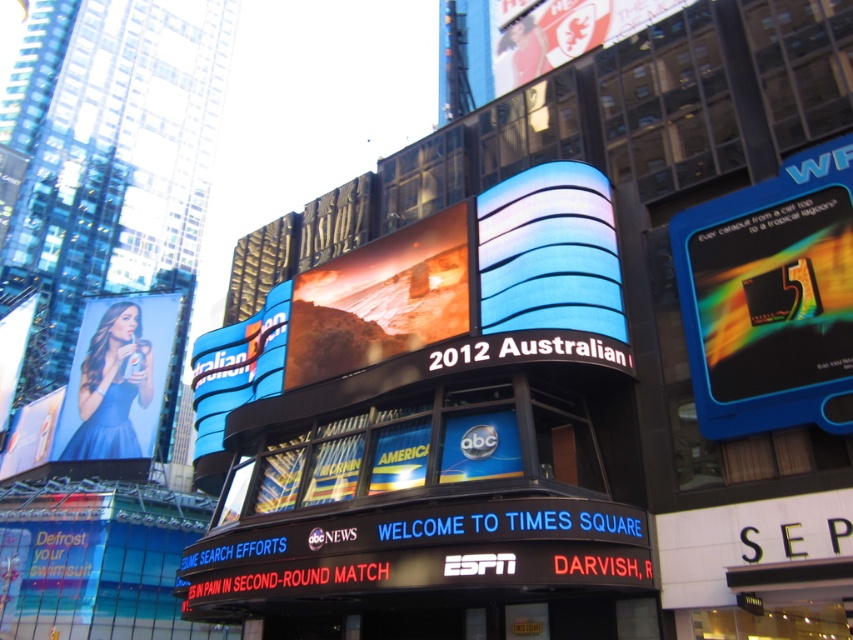
Does metallic silver lion at upper center have a smaller size compared to matte plastic billboard at upper left?

Yes.

Is metallic silver lion at upper center bigger than matte plastic billboard at upper left?

No.

Who is more forward, (621,6) or (0,432)?

Point (621,6) is in front.

This screenshot has height=640, width=853. Find the location of `metallic silver lion at upper center`. metallic silver lion at upper center is located at coordinates (563, 32).

The height and width of the screenshot is (640, 853). Describe the element at coordinates (549, 252) in the screenshot. I see `blue glossy billboard at center` at that location.

From the picture: Is blue glossy billboard at center positioned in front of matte glass billboard at center?

That is True.

Is point (566, 195) in front of point (438, 237)?

Yes, point (566, 195) is in front of point (438, 237).

Locate an element on the screen. The image size is (853, 640). blue glossy billboard at center is located at coordinates (549, 252).

Between blue glossy dress at left and matte blue billboard at lower left, which one appears on the left side from the viewer's perspective?

Positioned to the left is matte blue billboard at lower left.

Who is more distant from viewer, (105, 458) or (54, 426)?

Positioned behind is point (54, 426).

Between point (86, 337) and point (4, 454), which one is positioned in front?

Point (86, 337)

Identify the location of blue glossy dress at left. The width and height of the screenshot is (853, 640). (117, 378).